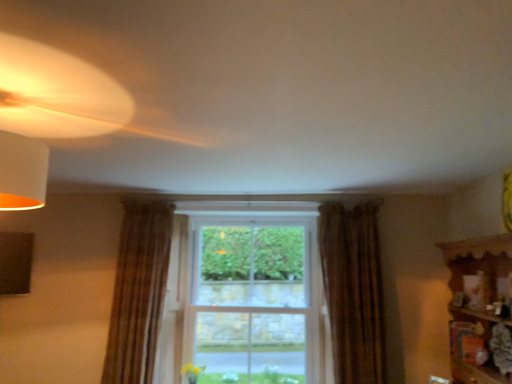
Question: Is brown textured curtain at right, the 1th curtain viewed from the right, inside or outside of wooden shelf at right?

Choices:
 (A) inside
 (B) outside

Answer: (B)

Question: Considering the positions of brown textured curtain at right, the 1th curtain viewed from the right, and wooden shelf at right in the image, is brown textured curtain at right, the 1th curtain viewed from the right, wider or thinner than wooden shelf at right?

Choices:
 (A) wide
 (B) thin

Answer: (B)

Question: Based on their relative distances, which object is nearer to the brown textured curtain at right, which ranks as the 2th curtain in left-to-right order?

Choices:
 (A) clear glass window at center
 (B) wooden shelf at right
 (C) brown textured curtain at left, which ranks as the first curtain in left-to-right order

Answer: (B)

Question: Estimate the real-world distances between objects in this image. Which object is closer to the brown textured curtain at left, which appears as the second curtain when viewed from the right?

Choices:
 (A) clear glass window at center
 (B) brown textured curtain at right, the 1th curtain viewed from the right
 (C) wooden shelf at right

Answer: (B)